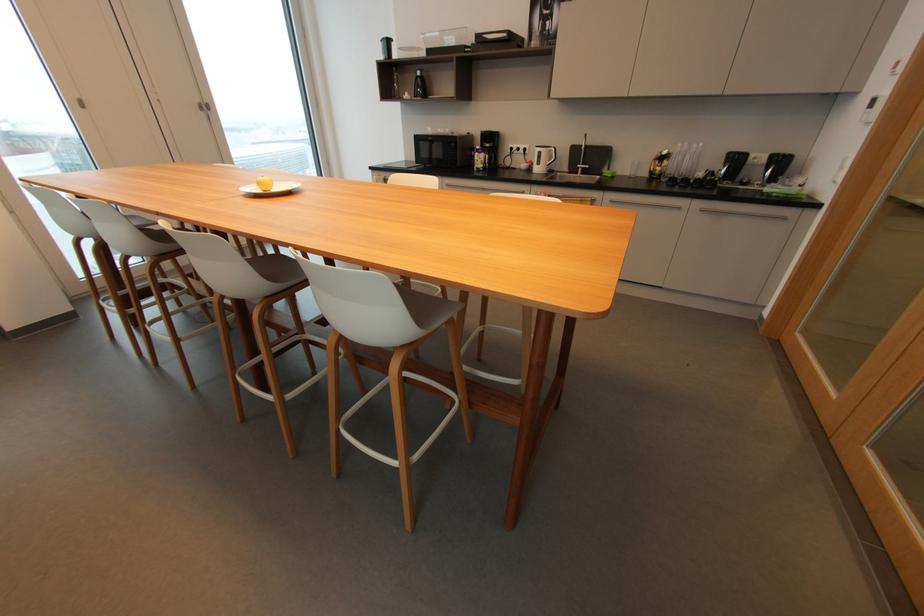
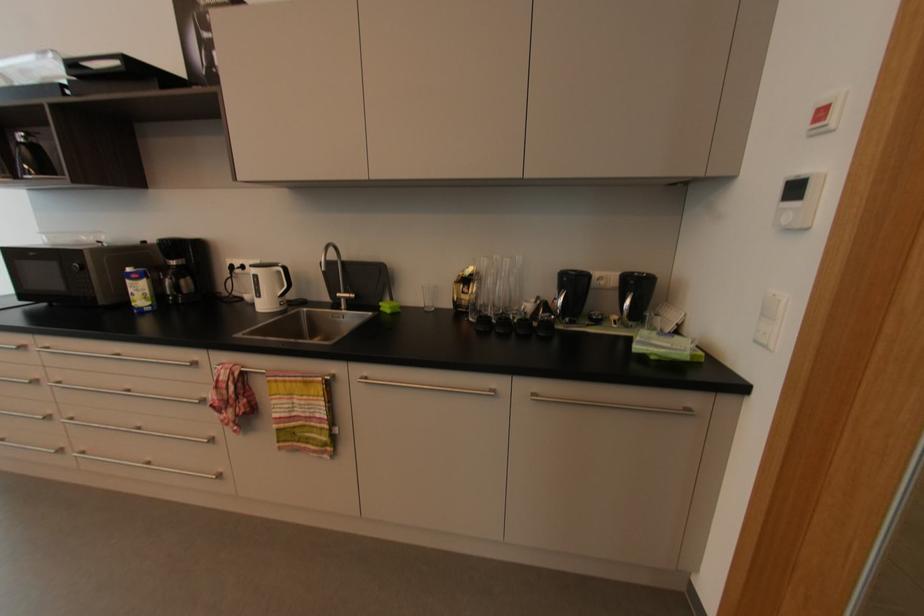
Where in the second image is the point corresponding to point 776,195 from the first image?

(657, 358)